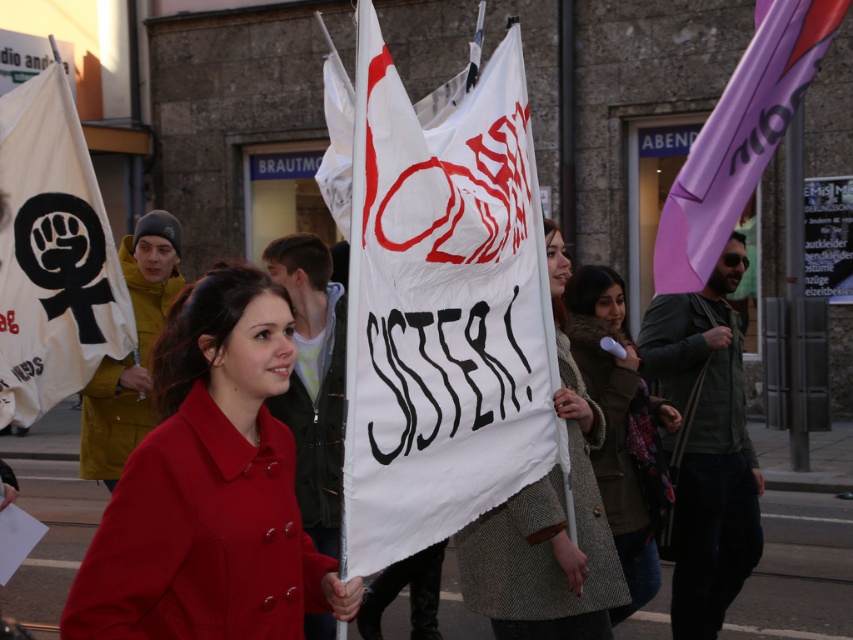
Between point (355, 520) and point (560, 516), which one is positioned in front?

Point (355, 520)

Measure the distance between white paper banner at center and camera.

white paper banner at center and camera are 2.22 meters apart.

Is point (355, 292) more distant than point (502, 515)?

No, (355, 292) is in front of (502, 515).

Locate an element on the screen. The image size is (853, 640). white paper banner at center is located at coordinates (442, 308).

The image size is (853, 640). What do you see at coordinates (51, 256) in the screenshot? I see `white paper flag at left` at bounding box center [51, 256].

Which of these two, white paper flag at left or white woolen coat at center, stands taller?

Standing taller between the two is white paper flag at left.

Between point (33, 118) and point (488, 522), which one is positioned behind?

The point (33, 118) is more distant.

Image resolution: width=853 pixels, height=640 pixels. I want to click on white paper flag at left, so pos(51,256).

Is white paper banner at center below cozy woolen coat at center?

No, white paper banner at center is not below cozy woolen coat at center.

Who is lower down, white paper banner at center or cozy woolen coat at center?

cozy woolen coat at center is lower down.

At what (x,y) coordinates should I click in order to perform the action: click on white paper banner at center. Please return your answer as a coordinate pair (x, y). Looking at the image, I should click on (442, 308).